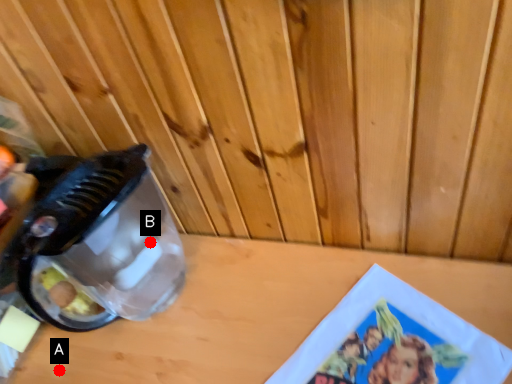
Question: Two points are circled on the image, labeled by A and B beside each circle. Which point appears farthest from the camera in this image?

Choices:
 (A) A is further
 (B) B is further

Answer: (B)